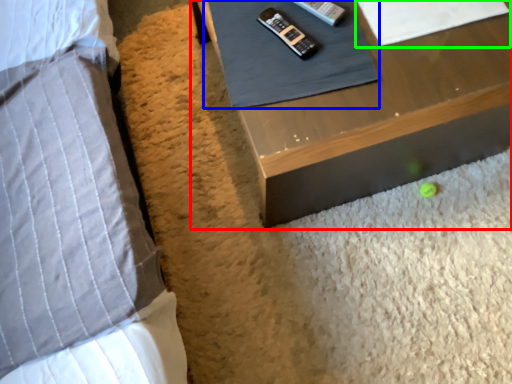
Question: Which object is the closest to the table (highlighted by a red box)? Choose among these: sheet (highlighted by a blue box) or sheet (highlighted by a green box).

Choices:
 (A) sheet
 (B) sheet

Answer: (A)